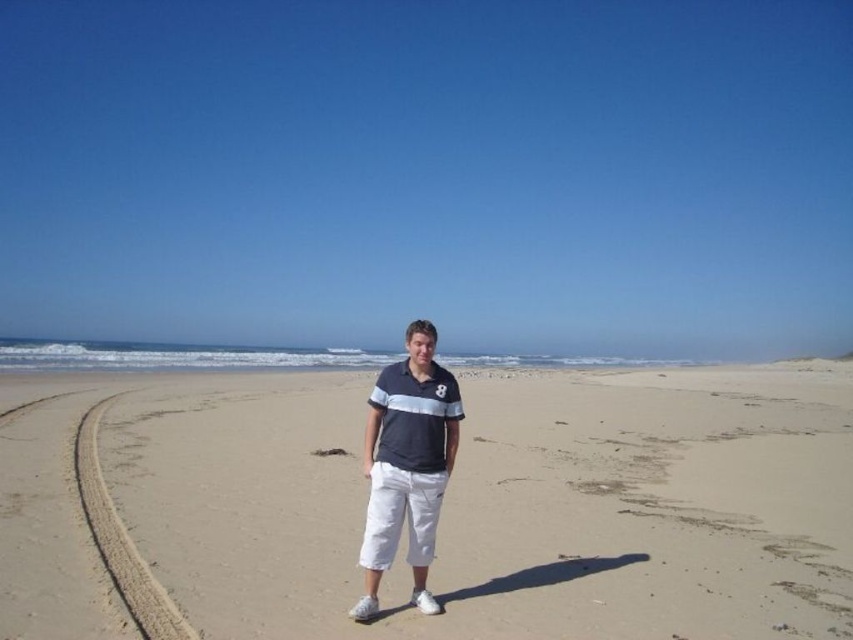
You are a photographer trying to capture a wide shot of the beach scene. Given that the sandy at center and the matte blue shirt at center are both in the frame, which object occupies more horizontal space in the image?

The sandy at center occupies more horizontal space in the image because its width is larger than that of the matte blue shirt at center.

You are standing on the beach and want to place a 20 meter long banner between the sandy at center and the matte blue shirt at center. Will the banner be long enough to stretch between them?

The sandy at center and matte blue shirt at center are 19.97 meters apart from each other. Since the banner is 20 meters long, it will be long enough to stretch between them with a small amount of extra length remaining.